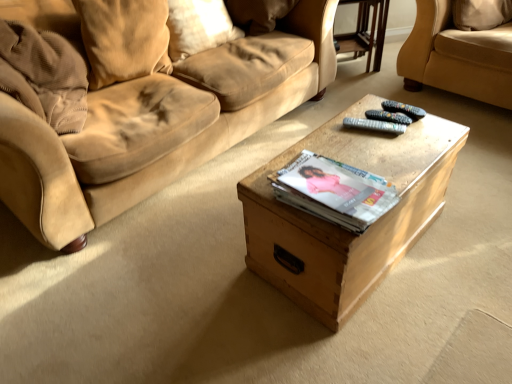
Question: Does point (418, 56) appear closer or farther from the camera than point (422, 110)?

Choices:
 (A) farther
 (B) closer

Answer: (A)

Question: Visually, is suede beige couch at upper right positioned to the left or to the right of black plastic remote at center, which appears as the second remote when ordered from the bottom?

Choices:
 (A) right
 (B) left

Answer: (A)

Question: Considering the real-world distances, which object is closest to the black plastic remote at center, which appears as the second remote when ordered from the bottom?

Choices:
 (A) wooden box at center
 (B) black plastic remote at center, arranged as the second remote when viewed from the top
 (C) suede pillow at upper left, positioned as the second pillow in left-to-right order
 (D) suede pillow at upper left, which appears as the 1th pillow when viewed from the left
 (E) transparent glass table at upper center

Answer: (B)

Question: Estimate the real-world distances between objects in this image. Which object is closer to the transparent glass table at upper center?

Choices:
 (A) suede pillow at upper left, which appears as the 1th pillow when viewed from the left
 (B) matte paper magazine at center
 (C) black plastic remote at center, arranged as the second remote when viewed from the top
 (D) black plastic remote at center, which appears as the second remote when ordered from the bottom
 (E) suede beige couch at upper right

Answer: (E)